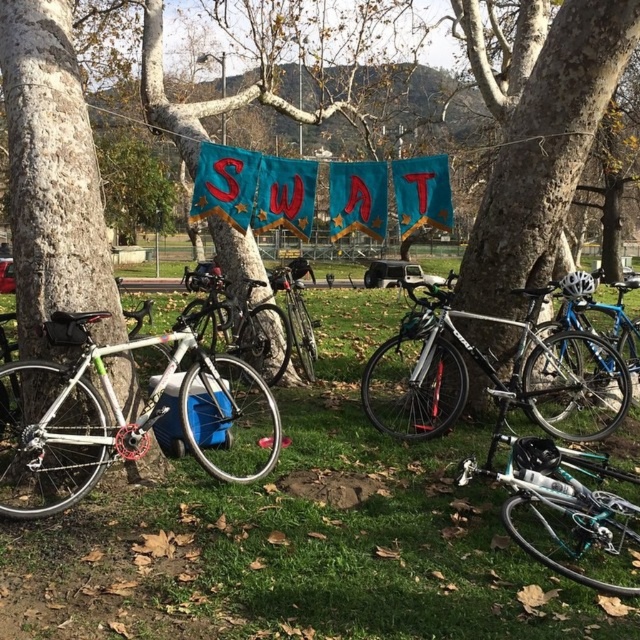
Who is positioned more to the left, green grass at lower center or shiny blue bicycle at center?

Positioned to the left is green grass at lower center.

Does green grass at lower center lie in front of shiny blue bicycle at center?

No, it is not.

Who is more forward, (68, 568) or (621, 307)?

Point (68, 568) is in front.

Where is `green grass at lower center`? The image size is (640, 640). green grass at lower center is located at coordinates (300, 536).

Between silver metallic bicycle at center and shiny silver bicycle at center, which one has less height?

silver metallic bicycle at center is shorter.

Is silver metallic bicycle at center below shiny silver bicycle at center?

Yes.

Does point (438, 417) come behind point (301, 298)?

No, it is in front of (301, 298).

At what (x,y) coordinates should I click in order to perform the action: click on silver metallic bicycle at center. Please return your answer as a coordinate pair (x, y). The height and width of the screenshot is (640, 640). Looking at the image, I should click on (496, 378).

Who is positioned more to the right, green grass at lower center or white matte bicycle at left?

Positioned to the right is green grass at lower center.

Based on the photo, which is below, green grass at lower center or white matte bicycle at left?

green grass at lower center

Does point (113, 579) come behind point (198, 440)?

No.

This screenshot has width=640, height=640. I want to click on green grass at lower center, so 300,536.